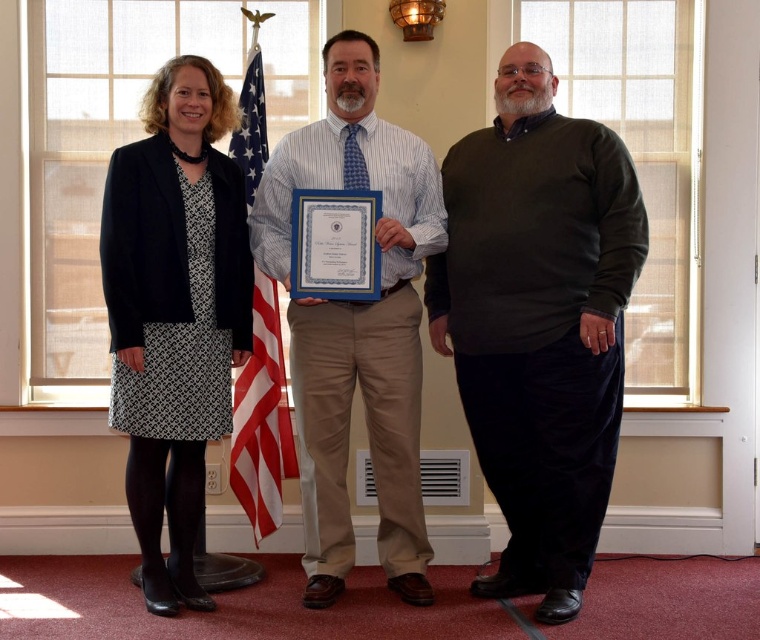
Can you confirm if matte black dress at center is positioned above american flag at center?

Yes.

Where is `matte black dress at center`? The width and height of the screenshot is (760, 640). matte black dress at center is located at coordinates (537, 321).

Is matte black dress at center positioned before striped cotton shirt at center?

Yes, matte black dress at center is closer to the viewer.

This screenshot has height=640, width=760. What are the coordinates of `matte black dress at center` in the screenshot? It's located at (537, 321).

Is point (523, 440) closer to viewer compared to point (271, 260)?

No, it is behind (271, 260).

Who is more distant from viewer, (x=496, y=134) or (x=333, y=49)?

Point (x=496, y=134)

What do you see at coordinates (537, 321) in the screenshot? The width and height of the screenshot is (760, 640). I see `dark green sweater at center` at bounding box center [537, 321].

Find the location of a particular element. The width and height of the screenshot is (760, 640). dark green sweater at center is located at coordinates (537, 321).